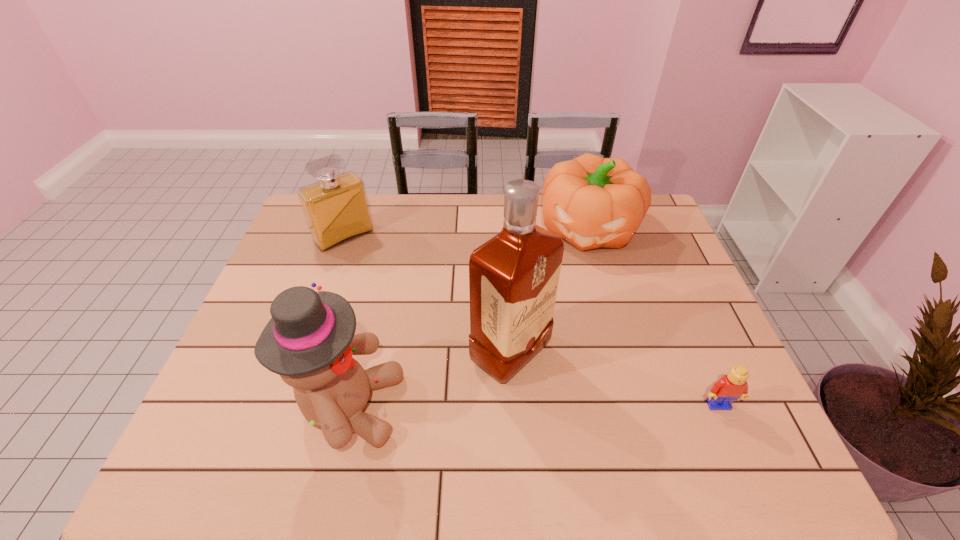
At what (x,y) coordinates should I click in order to perform the action: click on vacant region located on the front-facing side of the perfume. Please return your answer as a coordinate pair (x, y). This screenshot has height=540, width=960. Looking at the image, I should click on (384, 280).

Image resolution: width=960 pixels, height=540 pixels. What are the coordinates of `blank space located 0.090m on the front-facing side of the perfume` in the screenshot? It's located at (371, 265).

Image resolution: width=960 pixels, height=540 pixels. Identify the location of vacant region located 0.220m on the front-facing side of the perfume. (392, 289).

Find the location of a particular element. The width and height of the screenshot is (960, 540). free space located 0.160m on the front label of the liquor is located at coordinates (600, 421).

At what (x,y) coordinates should I click in order to perform the action: click on free space located on the front label of the liquor. Please return your answer as a coordinate pair (x, y). This screenshot has width=960, height=540. Looking at the image, I should click on (585, 410).

Find the location of a particular element. The width and height of the screenshot is (960, 540). pumpkin that is at the far edge is located at coordinates 592,202.

Find the location of `perfume at the far edge`. perfume at the far edge is located at coordinates (336, 209).

This screenshot has width=960, height=540. Find the location of `rag_doll at the near edge`. rag_doll at the near edge is located at coordinates (309, 341).

This screenshot has height=540, width=960. What are the coordinates of `Lego that is at the near edge` in the screenshot? It's located at (730, 387).

The image size is (960, 540). Find the location of `liquor present at the near edge`. liquor present at the near edge is located at coordinates (513, 278).